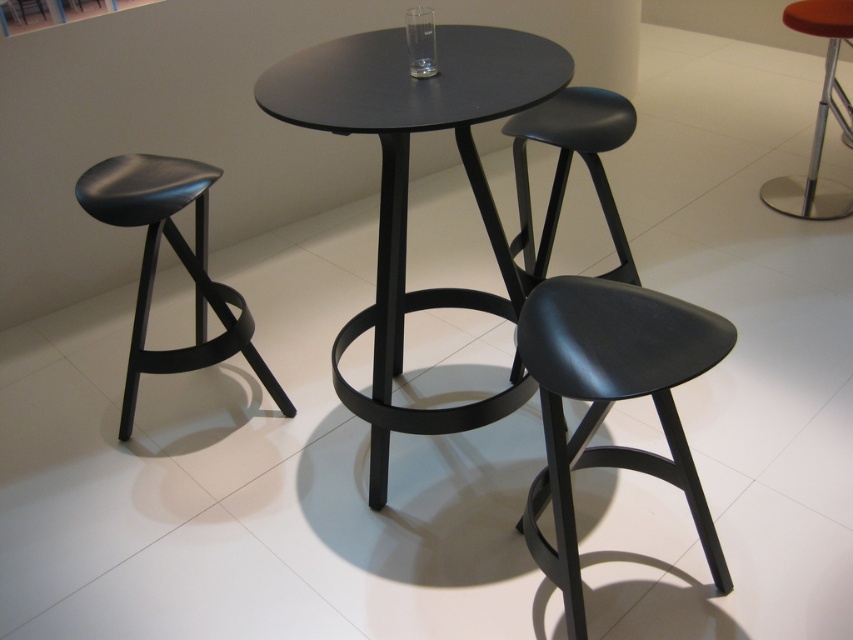
You are designing a small kitchen counter and need to choose between the matte black stool at left and the orange leather bar stool at right. Since space is limited, which stool should you pick to ensure it doesn not take up too much room?

The orange leather bar stool at right should be chosen because it has a smaller size compared to the matte black stool at left, making it more suitable for limited spaces.

You are standing in a showroom and want to pick up the matte black stool at left. Considering your arm length is 0.7 meters, can you reach it without moving your feet?

The matte black stool at left is 1.86 meters away from you. Since your arm length is only 0.7 meters, you cannot reach it without moving your feet.

You are a photographer standing at the camera position. You want to take a closeup shot of the matte black stool at center without moving the stool. Can you move closer to the stool to get a better closeup?

The distance between the matte black stool at center and the camera is 1.22 meters. Since you can move closer to the stool, you can reduce this distance to achieve a better closeup shot.